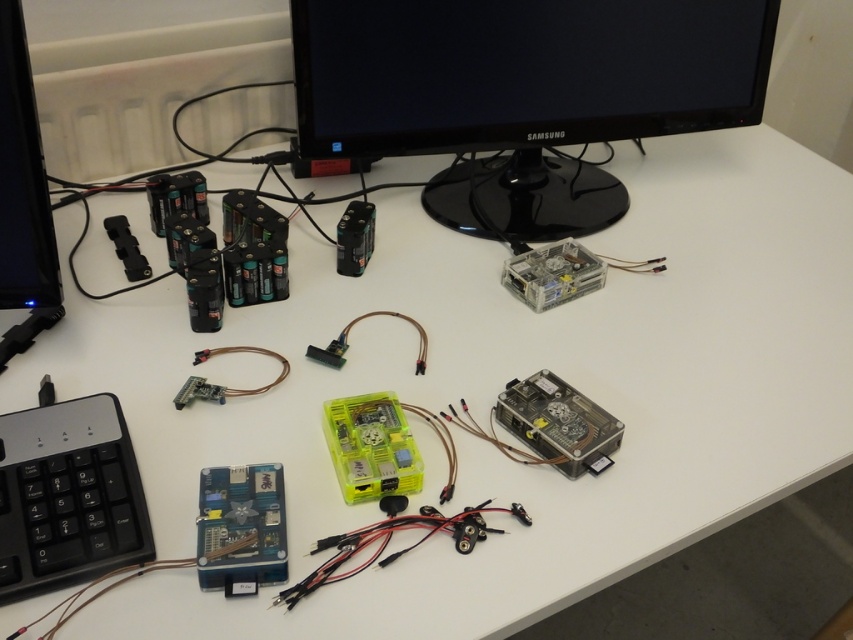
You are setting up a new desk arrangement and want to place a decorative item between the black glossy monitor at upper center and the black plastic keyboard at lower left. Considering their widths, which object should you place the decorative item closer to?

The black glossy monitor at upper center is wider than the black plastic keyboard at lower left. Therefore, you should place the decorative item closer to the black plastic keyboard at lower left to balance the width difference.

You are setting up a new workspace and need to place both the black plastic keyboard at lower left and the blue plastic circuit board at lower left on your desk. If you want to place them side by side horizontally, which object should you place first to ensure they fit without overlapping?

The black plastic keyboard at lower left should be placed first since it is wider than the blue plastic circuit board at lower left, allowing enough space for both when placed side by side horizontally.

You are standing in front of the desk and want to pick up an object. If you move your hand towards the point closer to the camera between point (x=68, y=449) and point (x=206, y=579), which point will you reach first?

You will reach point (x=68, y=449) first because it is closer to the camera than point (x=206, y=579).